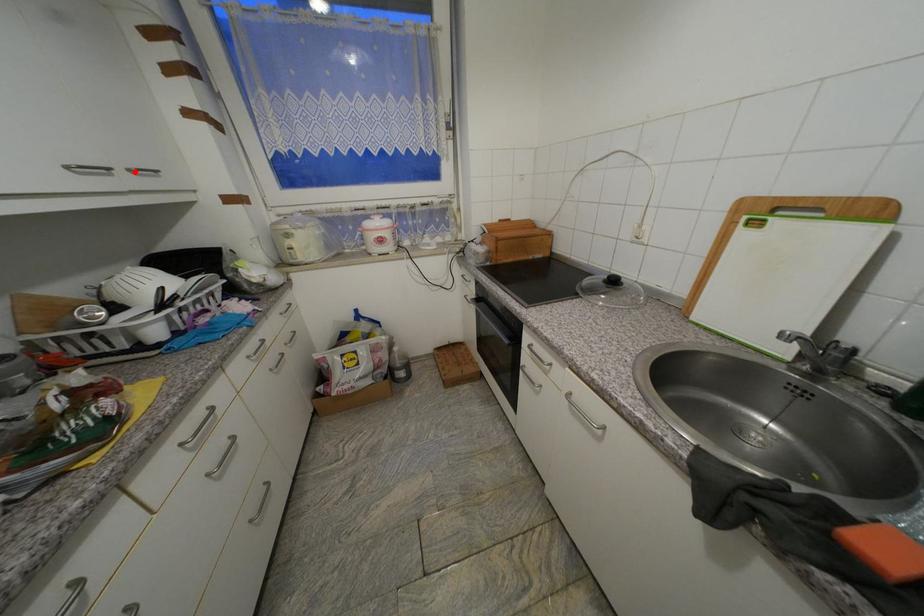
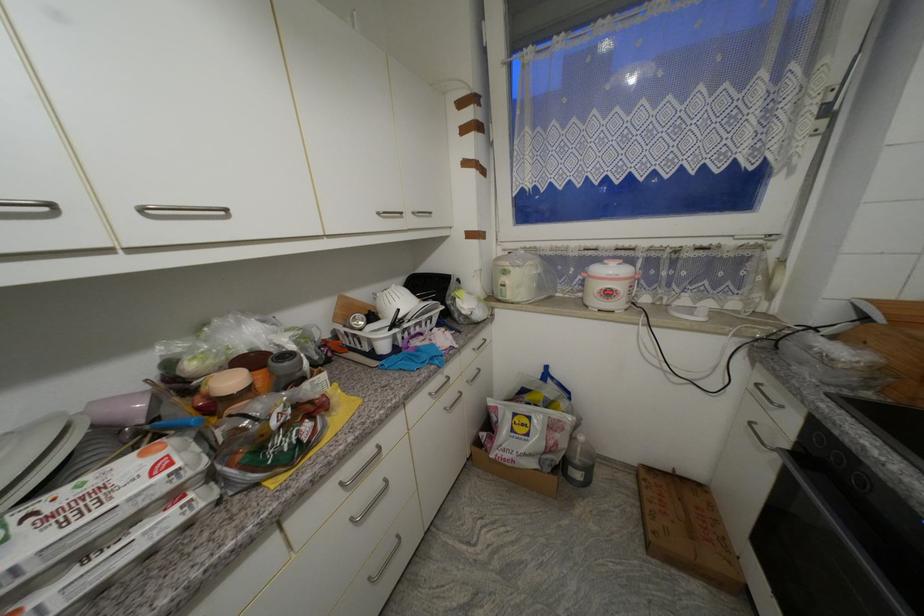
The point at the highlighted location is marked in the first image. Where is the corresponding point in the second image?

(419, 215)